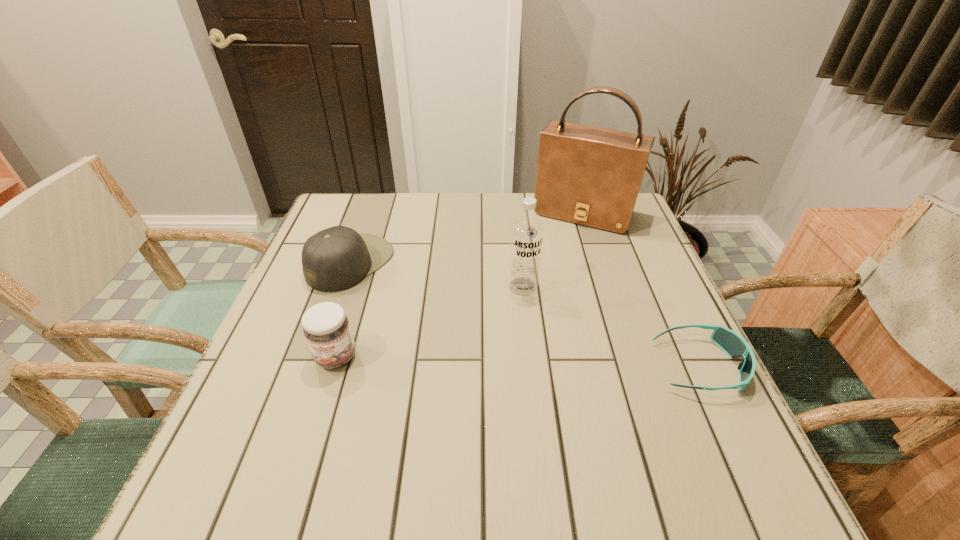
The height and width of the screenshot is (540, 960). I want to click on vacant space positioned 0.350m on the front label of the second tallest object, so click(x=496, y=431).

Find the location of `vacant position located on the front label of the second tallest object`. vacant position located on the front label of the second tallest object is located at coordinates (510, 356).

You are a GUI agent. You are given a task and a screenshot of the screen. Output one action in this format:
    pyautogui.click(x=<x>, y=<y>)
    Task: Click on the free region located 0.100m on the front label of the second tallest object
    The width and height of the screenshot is (960, 540).
    Given the screenshot: What is the action you would take?
    pyautogui.click(x=516, y=328)

The height and width of the screenshot is (540, 960). Find the location of `vacant space located 0.400m on the brim of the cap`. vacant space located 0.400m on the brim of the cap is located at coordinates (524, 345).

At what (x,y) coordinates should I click in order to perform the action: click on vacant region located 0.150m on the brim of the cap. Please return your answer as a coordinate pair (x, y). The width and height of the screenshot is (960, 540). Looking at the image, I should click on (429, 300).

Locate an element on the screen. The image size is (960, 540). blank space located 0.100m on the brim of the cap is located at coordinates (413, 293).

Find the location of `shoulder bag at the far edge`. shoulder bag at the far edge is located at coordinates (587, 175).

In order to click on cap that is at the far edge in this screenshot , I will do `click(337, 258)`.

Identify the location of jam at the left edge. The width and height of the screenshot is (960, 540). (326, 328).

This screenshot has width=960, height=540. What are the coordinates of `cap present at the left edge` in the screenshot? It's located at (337, 258).